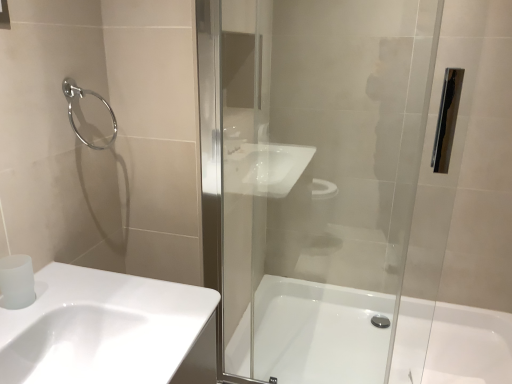
Question: From a real-world perspective, is white glossy bathtub at center located beneath satin white toilet paper at lower left?

Choices:
 (A) yes
 (B) no

Answer: (A)

Question: Is white glossy bathtub at center to the right of satin white toilet paper at lower left from the viewer's perspective?

Choices:
 (A) no
 (B) yes

Answer: (B)

Question: From a real-world perspective, is white glossy bathtub at center located higher than satin white toilet paper at lower left?

Choices:
 (A) no
 (B) yes

Answer: (A)

Question: Is white glossy bathtub at center looking in the opposite direction of satin white toilet paper at lower left?

Choices:
 (A) yes
 (B) no

Answer: (B)

Question: Considering the relative sizes of white glossy bathtub at center and satin white toilet paper at lower left in the image provided, is white glossy bathtub at center bigger than satin white toilet paper at lower left?

Choices:
 (A) yes
 (B) no

Answer: (A)

Question: Is white glossy bathtub at center taller or shorter than satin white toilet paper at lower left?

Choices:
 (A) tall
 (B) short

Answer: (A)

Question: From the image's perspective, is white glossy bathtub at center located above or below satin white toilet paper at lower left?

Choices:
 (A) above
 (B) below

Answer: (B)

Question: Is white glossy bathtub at center spatially inside satin white toilet paper at lower left, or outside of it?

Choices:
 (A) inside
 (B) outside

Answer: (B)

Question: Relative to satin white toilet paper at lower left, is white glossy bathtub at center in front or behind?

Choices:
 (A) behind
 (B) front

Answer: (A)

Question: Considering the positions of point (74, 125) and point (28, 292), is point (74, 125) closer or farther from the camera than point (28, 292)?

Choices:
 (A) closer
 (B) farther

Answer: (B)

Question: From a real-world perspective, relative to satin white toilet paper at lower left, is chrome metallic towel ring at upper left vertically above or below?

Choices:
 (A) above
 (B) below

Answer: (A)

Question: Is chrome metallic towel ring at upper left bigger or smaller than satin white toilet paper at lower left?

Choices:
 (A) big
 (B) small

Answer: (A)

Question: Is chrome metallic towel ring at upper left taller or shorter than satin white toilet paper at lower left?

Choices:
 (A) tall
 (B) short

Answer: (A)

Question: Looking at their shapes, would you say white glossy sink at lower left is wider or thinner than transparent glass shower door at center?

Choices:
 (A) wide
 (B) thin

Answer: (A)

Question: Visually, is white glossy sink at lower left positioned to the left or to the right of transparent glass shower door at center?

Choices:
 (A) right
 (B) left

Answer: (B)